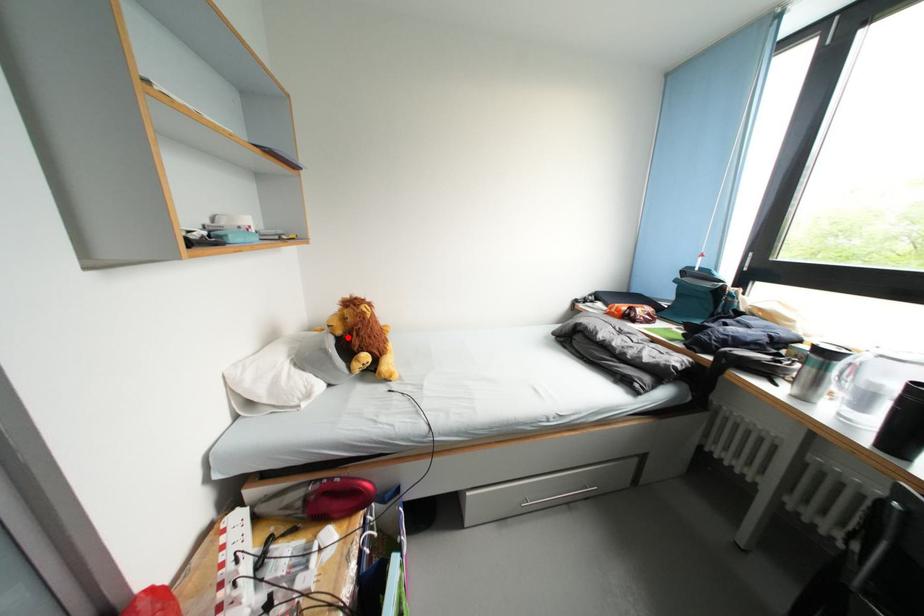
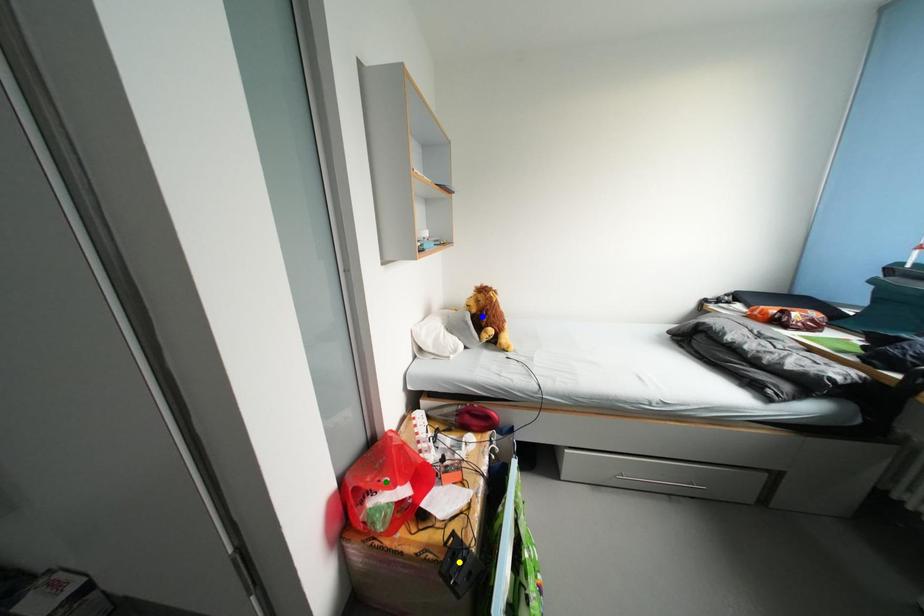
Question: I am providing you with two images of the same scene from different viewpoints. A red point is marked on the first image. You are given multiple points on the second image. Which point in image 2 is actually the same real-world point as the red point in image 1?

Choices:
 (A) green point
 (B) yellow point
 (C) blue point

Answer: (C)